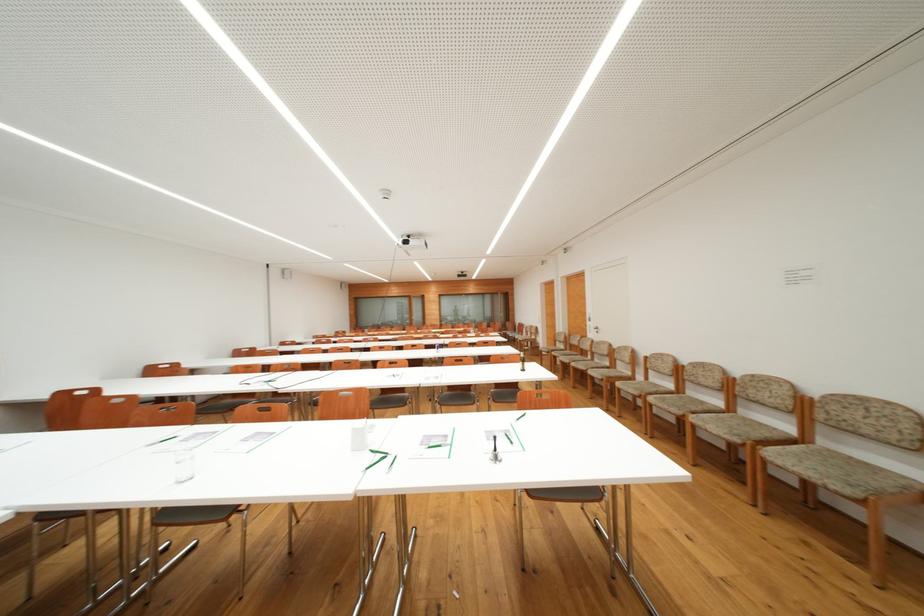
What do you see at coordinates (596, 329) in the screenshot? The height and width of the screenshot is (616, 924). I see `a silver door handle` at bounding box center [596, 329].